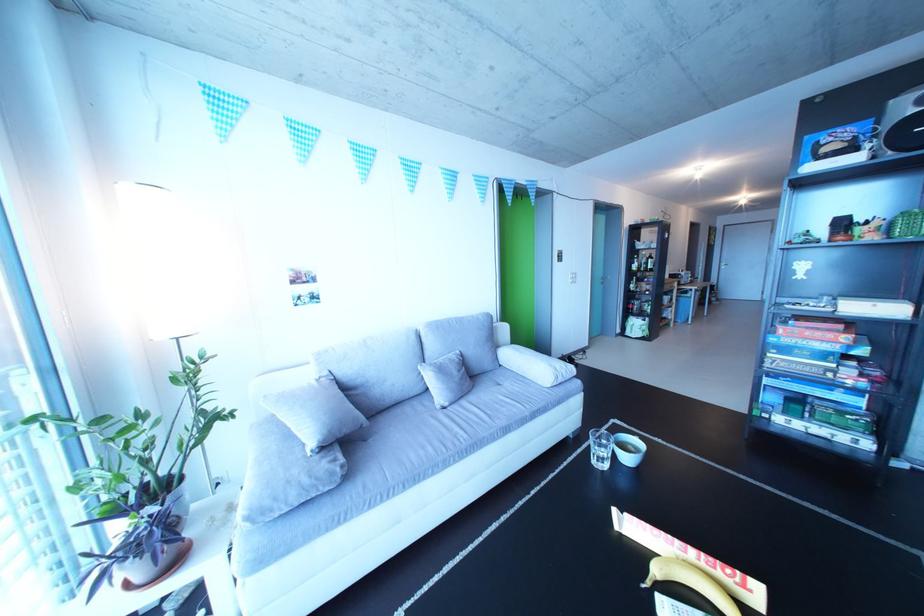
Image resolution: width=924 pixels, height=616 pixels. I want to click on white light switch, so click(572, 277).